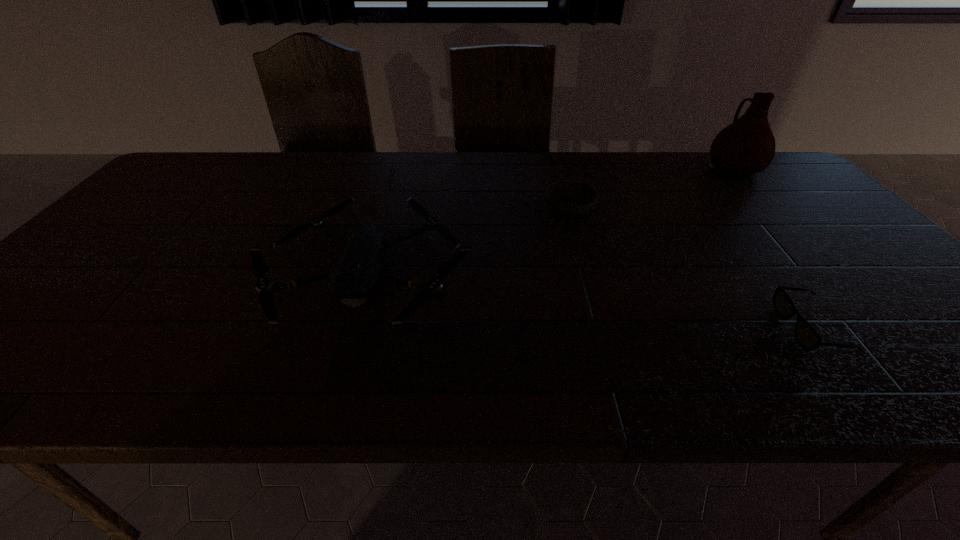
This screenshot has height=540, width=960. Identify the location of the tallest object. (747, 146).

Locate an element on the screen. the rightmost object is located at coordinates (747, 146).

You are a GUI agent. You are given a task and a screenshot of the screen. Output one action in this format:
    pyautogui.click(x=<x>, y=<y>)
    Task: Click on the drone
    
    Given the screenshot: What is the action you would take?
    pyautogui.click(x=355, y=275)

Locate an element on the screen. This screenshot has width=960, height=540. the leftmost object is located at coordinates (355, 275).

What are the coordinates of `bowl` in the screenshot? It's located at (568, 198).

Identify the location of sunglasses. The width and height of the screenshot is (960, 540). (807, 337).

Find the location of a particular element. This screenshot has width=960, height=540. vacant area situated 0.190m on the left of the third object from right to left is located at coordinates (477, 210).

This screenshot has height=540, width=960. I want to click on blank space located on the front-facing side of the sunglasses, so click(594, 329).

Find the location of a particular element. Image resolution: width=960 pixels, height=540 pixels. free spot located on the front-facing side of the sunglasses is located at coordinates (653, 329).

Image resolution: width=960 pixels, height=540 pixels. I want to click on blank space located on the front-facing side of the sunglasses, so click(643, 329).